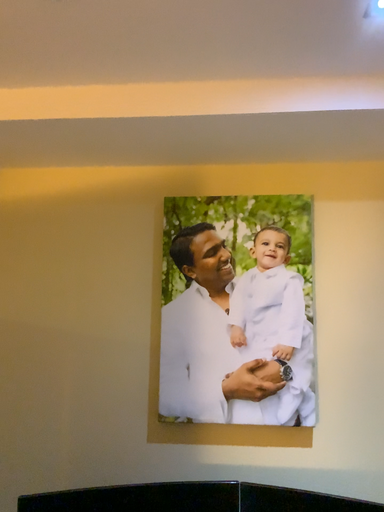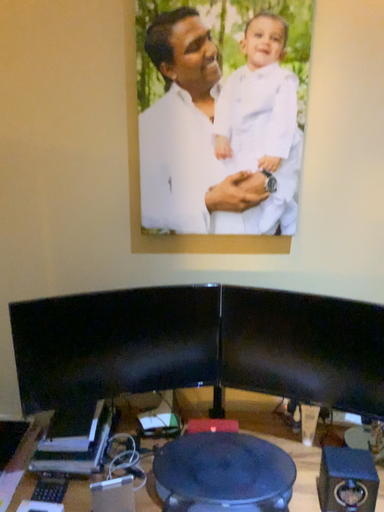
Question: Which way did the camera rotate in the video?

Choices:
 (A) rotated downward
 (B) rotated upward

Answer: (A)